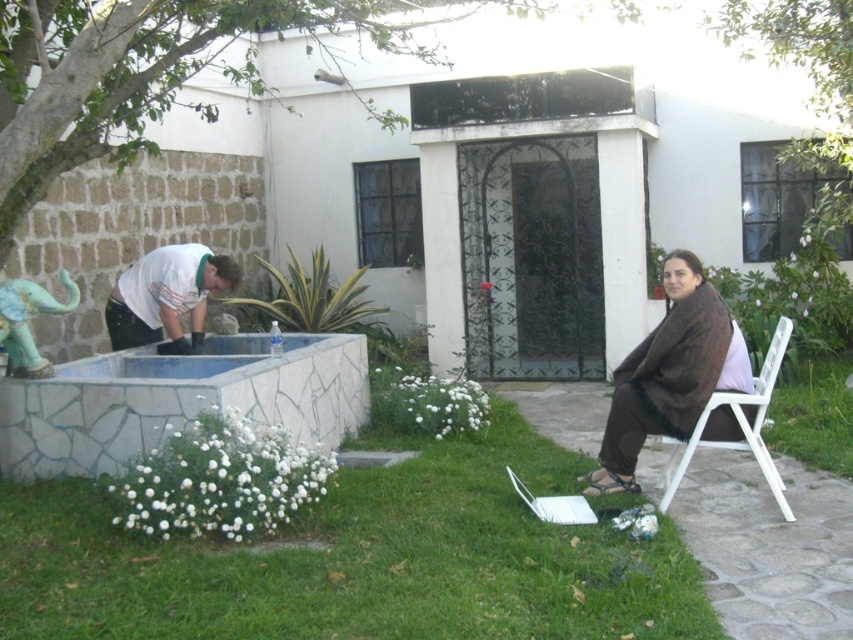
At what (x,y) coordinates should I click in order to perform the action: click on green grass at lower center. Please return your answer as a coordinate pair (x, y). Looking at the image, I should click on (358, 561).

From the picture: Does green grass at lower center appear on the left side of brown fabric at right?

Yes, green grass at lower center is to the left of brown fabric at right.

Is point (273, 570) positioned before point (729, 410)?

Yes, point (273, 570) is in front of point (729, 410).

The width and height of the screenshot is (853, 640). I want to click on green grass at lower center, so click(358, 561).

Is green grass at lower center further to the viewer compared to white t-shirt at left?

That is False.

Measure the distance between green grass at lower center and camera.

3.69 meters

This screenshot has width=853, height=640. What are the coordinates of `green grass at lower center` in the screenshot? It's located at (358, 561).

Is brown fabric at right shorter than white plastic chair at lower right?

Incorrect, brown fabric at right's height does not fall short of white plastic chair at lower right's.

Who is positioned more to the left, brown fabric at right or white plastic chair at lower right?

brown fabric at right

You are a GUI agent. You are given a task and a screenshot of the screen. Output one action in this format:
    pyautogui.click(x=<x>, y=<y>)
    Task: Click on the brown fabric at right
    Image resolution: width=853 pixels, height=640 pixels.
    Given the screenshot: What is the action you would take?
    pyautogui.click(x=670, y=372)